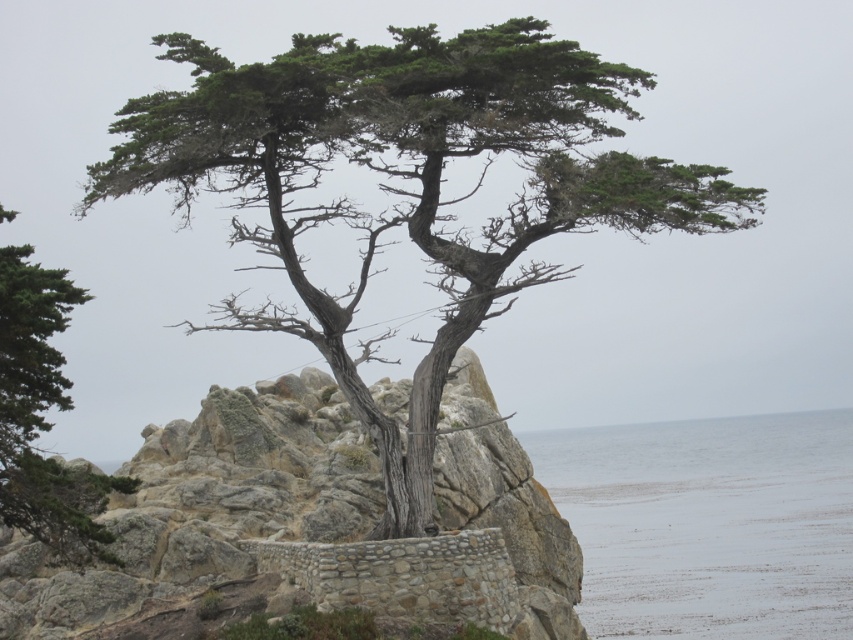
Which is below, green textured tree at center or green textured tree at left?

green textured tree at left is lower down.

Is green textured tree at center below green textured tree at left?

No, green textured tree at center is not below green textured tree at left.

Is point (440, 177) less distant than point (18, 362)?

That is False.

Identify the location of green textured tree at center. Image resolution: width=853 pixels, height=640 pixels. (409, 179).

Is the position of gray stone rock at center less distant than that of green textured tree at left?

No.

Which is above, gray stone rock at center or green textured tree at left?

green textured tree at left

You are a GUI agent. You are given a task and a screenshot of the screen. Output one action in this format:
    pyautogui.click(x=<x>, y=<y>)
    Task: Click on the gray stone rock at center
    Image resolution: width=853 pixels, height=640 pixels.
    Given the screenshot: What is the action you would take?
    pyautogui.click(x=206, y=506)

Locate an element on the screen. The image size is (853, 640). gray stone rock at center is located at coordinates (206, 506).

Which is more to the right, gray/smooth water at lower center or green textured tree at left?

gray/smooth water at lower center

Is gray/smooth water at lower center taller than green textured tree at left?

In fact, gray/smooth water at lower center may be shorter than green textured tree at left.

Describe the element at coordinates (708, 524) in the screenshot. The height and width of the screenshot is (640, 853). I see `gray/smooth water at lower center` at that location.

Where is `gray/smooth water at lower center`? The height and width of the screenshot is (640, 853). gray/smooth water at lower center is located at coordinates (708, 524).